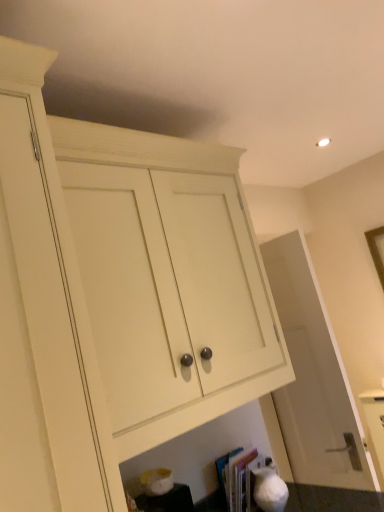
Question: Is white wood cabinet at center bigger than hardcover book at lower center?

Choices:
 (A) no
 (B) yes

Answer: (B)

Question: Is white wood cabinet at center wider than hardcover book at lower center?

Choices:
 (A) yes
 (B) no

Answer: (A)

Question: Is white wood cabinet at center closer to the viewer compared to hardcover book at lower center?

Choices:
 (A) no
 (B) yes

Answer: (B)

Question: Does white wood cabinet at center have a greater height compared to hardcover book at lower center?

Choices:
 (A) no
 (B) yes

Answer: (B)

Question: Is white wood cabinet at center far away from hardcover book at lower center?

Choices:
 (A) no
 (B) yes

Answer: (A)

Question: Is white wood cabinet at center further to camera compared to hardcover book at lower center?

Choices:
 (A) yes
 (B) no

Answer: (B)

Question: Can we say hardcover book at lower center lies outside white wood cabinet at center?

Choices:
 (A) no
 (B) yes

Answer: (B)

Question: Considering the relative positions of hardcover book at lower center and white wood cabinet at center in the image provided, is hardcover book at lower center to the left of white wood cabinet at center from the viewer's perspective?

Choices:
 (A) no
 (B) yes

Answer: (A)

Question: Is hardcover book at lower center aimed at white wood cabinet at center?

Choices:
 (A) yes
 (B) no

Answer: (B)

Question: Is hardcover book at lower center surrounding white wood cabinet at center?

Choices:
 (A) yes
 (B) no

Answer: (B)

Question: From the image's perspective, would you say hardcover book at lower center is shown under white wood cabinet at center?

Choices:
 (A) no
 (B) yes

Answer: (B)

Question: From a real-world perspective, is hardcover book at lower center beneath white wood cabinet at center?

Choices:
 (A) yes
 (B) no

Answer: (A)

Question: Can you confirm if hardcover book at lower center is smaller than white matte door at center?

Choices:
 (A) yes
 (B) no

Answer: (A)